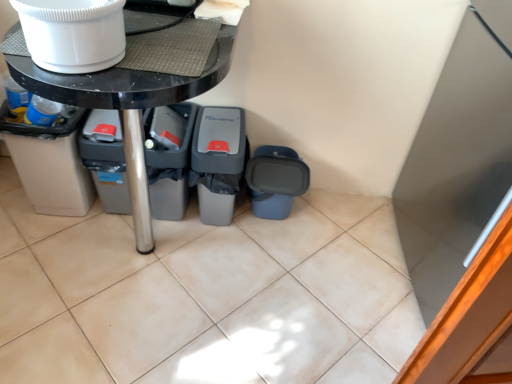
Question: Does gray plastic bin at lower left have a lesser height compared to white glossy refrigerator at upper right?

Choices:
 (A) yes
 (B) no

Answer: (A)

Question: Is gray plastic bin at lower left facing towards white glossy refrigerator at upper right?

Choices:
 (A) no
 (B) yes

Answer: (A)

Question: Is gray plastic bin at lower left to the left of white glossy refrigerator at upper right from the viewer's perspective?

Choices:
 (A) no
 (B) yes

Answer: (B)

Question: Are gray plastic bin at lower left and white glossy refrigerator at upper right beside each other?

Choices:
 (A) yes
 (B) no

Answer: (B)

Question: Is gray plastic bin at lower left taller than white glossy refrigerator at upper right?

Choices:
 (A) yes
 (B) no

Answer: (B)

Question: Is gray plastic bin at lower left thinner than white glossy refrigerator at upper right?

Choices:
 (A) yes
 (B) no

Answer: (A)

Question: Does gray plastic recycling bin at center, marked as the 3th recycling bin in a left-to-right arrangement, have a larger size compared to gray plastic bin at lower left?

Choices:
 (A) yes
 (B) no

Answer: (A)

Question: Is gray plastic recycling bin at center, marked as the 3th recycling bin in a left-to-right arrangement, far away from gray plastic bin at lower left?

Choices:
 (A) no
 (B) yes

Answer: (A)

Question: Can you confirm if gray plastic recycling bin at center, which is the second recycling bin from right to left, is positioned to the right of gray plastic bin at lower left?

Choices:
 (A) yes
 (B) no

Answer: (A)

Question: Can you confirm if gray plastic recycling bin at center, marked as the 3th recycling bin in a left-to-right arrangement, is shorter than gray plastic bin at lower left?

Choices:
 (A) yes
 (B) no

Answer: (A)

Question: Does gray plastic recycling bin at center, which is the second recycling bin from right to left, have a smaller size compared to gray plastic bin at lower left?

Choices:
 (A) no
 (B) yes

Answer: (A)

Question: Can you confirm if gray plastic recycling bin at center, marked as the 3th recycling bin in a left-to-right arrangement, is taller than gray plastic bin at lower left?

Choices:
 (A) yes
 (B) no

Answer: (B)

Question: From a real-world perspective, is gray plastic recycling bin at center, marked as the 3th recycling bin in a left-to-right arrangement, beneath white glossy refrigerator at upper right?

Choices:
 (A) yes
 (B) no

Answer: (A)